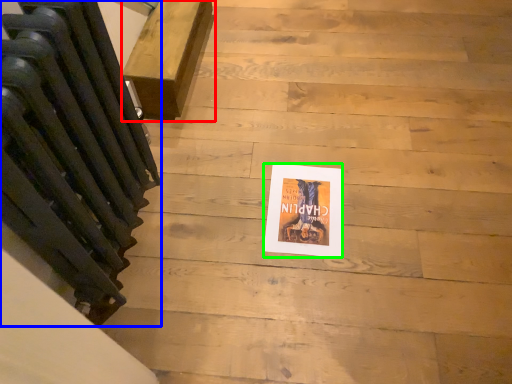
Question: Which object is the farthest from furniture (highlighted by a red box)? Choose among these: radiator (highlighted by a blue box) or flyer (highlighted by a green box).

Choices:
 (A) radiator
 (B) flyer

Answer: (B)